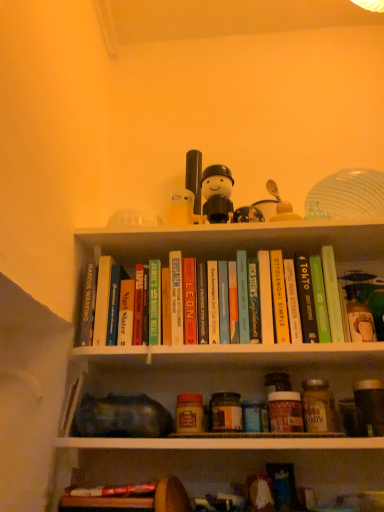
Question: From the image's perspective, is hardcover book at center, arranged as the fifth paperback book when viewed from the right, positioned above or below teal matte book at center, which is the fourth paperback book in left-to-right order?

Choices:
 (A) above
 (B) below

Answer: (A)

Question: From a real-world perspective, is hardcover book at center, which is the 6th paperback book from left to right, physically located above or below teal matte book at center, which is the fourth paperback book in left-to-right order?

Choices:
 (A) above
 (B) below

Answer: (B)

Question: Estimate the real-world distances between objects in this image. Which object is farther from the hardcover book at center, which appears as the 6th paperback book when viewed from the right?

Choices:
 (A) green matte book at upper center, marked as the 10th paperback book in a left-to-right arrangement
 (B) white matte figurine at upper center
 (C) hardcover book at center, arranged as the fifth paperback book when viewed from the right
 (D) hardcover book at upper center, which ranks as the eighth paperback book in left-to-right order
 (E) green matte toy at upper right, placed as the 2th toy when sorted from back to front

Answer: (E)

Question: Which of these objects is positioned farthest from the hardcover book at center, acting as the first paperback book starting from the left?

Choices:
 (A) green matte book at upper right, which is the 9th paperback book in left-to-right order
 (B) hardcover book at upper center, which ranks as the eighth paperback book in left-to-right order
 (C) hardcover book at upper center, the 4th paperback book in the right-to-left sequence
 (D) hardcover book at center, which is the 6th paperback book from left to right
 (E) white plastic toy at upper center, acting as the 1th toy starting from the top

Answer: (A)